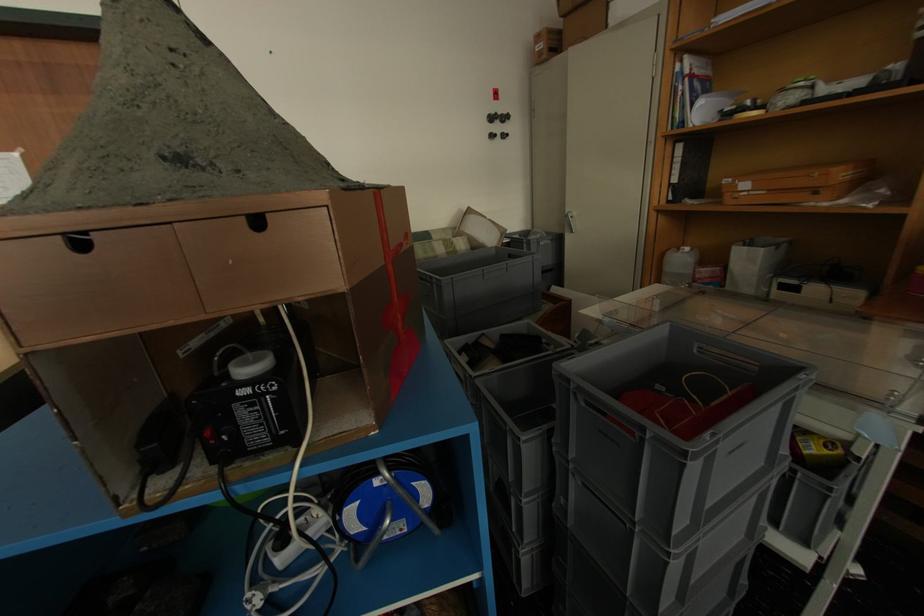
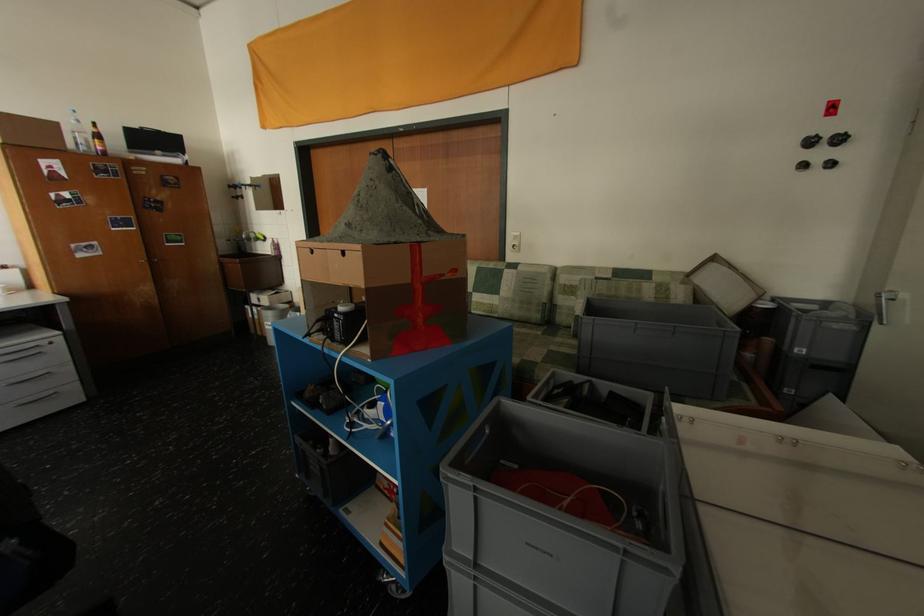
The point at [579,219] is marked in the first image. Where is the corresponding point in the second image?

(902, 301)